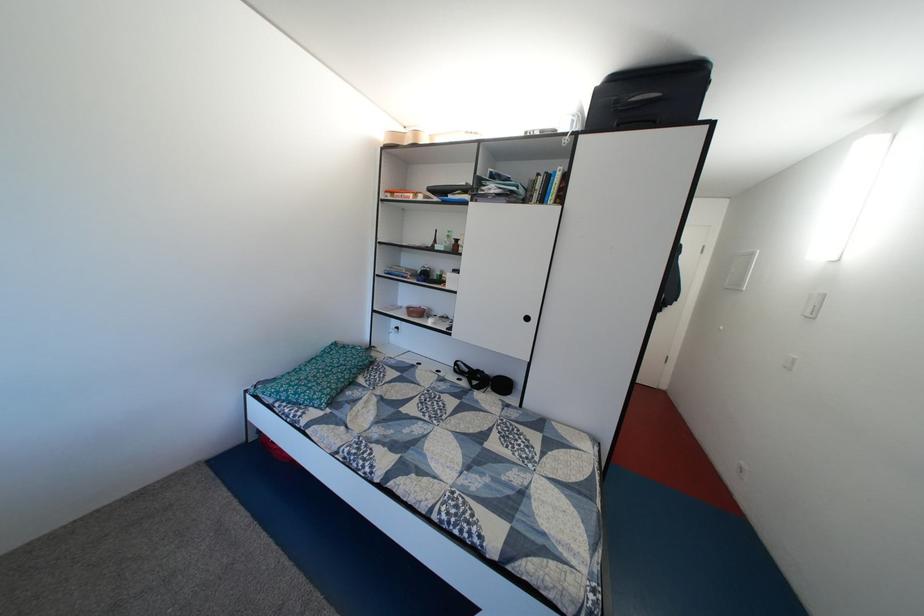
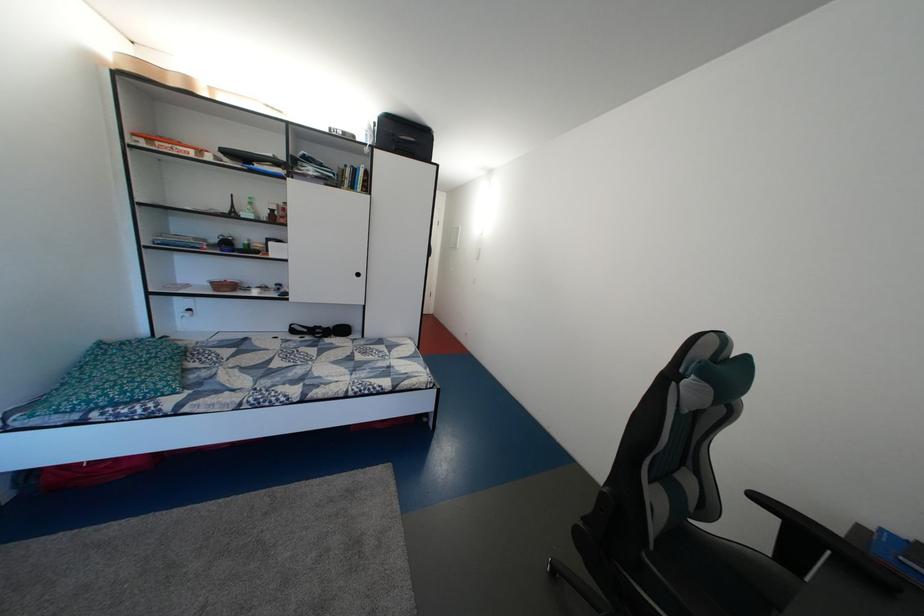
Where in the second image is the point corresponding to point 427,201 from the first image?

(211, 159)